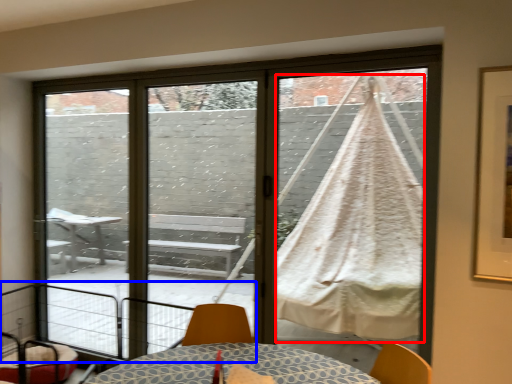
Question: Which object appears farthest to the camera in this image, blanket (highlighted by a red box) or balcony (highlighted by a blue box)?

Choices:
 (A) blanket
 (B) balcony

Answer: (A)